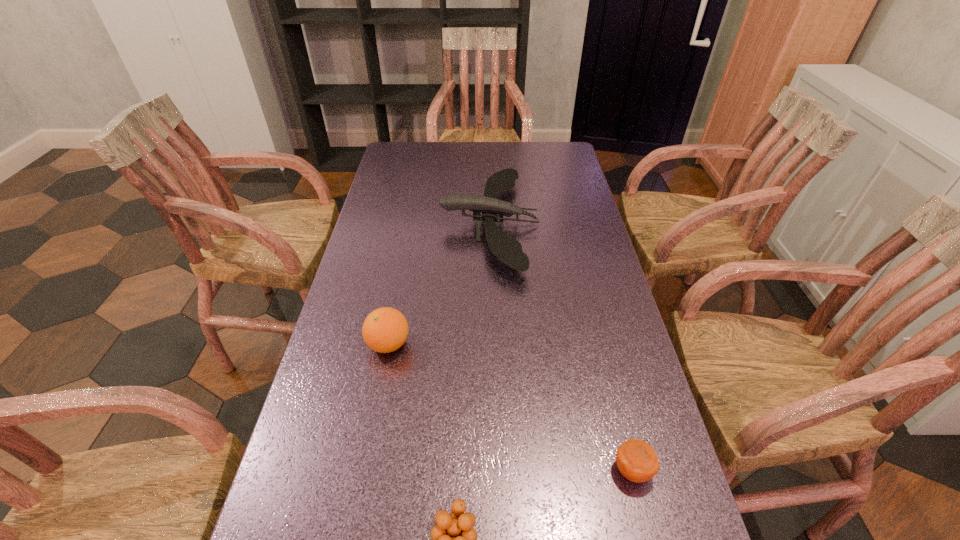
Find the location of a particular element. This screenshot has width=960, height=540. object that is positioned at the left edge is located at coordinates (384, 330).

Find the location of a particular element. object that is at the right edge is located at coordinates (637, 461).

The image size is (960, 540). Find the location of `free space at the far edge`. free space at the far edge is located at coordinates (468, 142).

Where is `vacant space at the left edge of the desktop`? This screenshot has height=540, width=960. vacant space at the left edge of the desktop is located at coordinates (370, 384).

Locate an element on the screen. The width and height of the screenshot is (960, 540). vacant space at the right edge of the desktop is located at coordinates (564, 234).

This screenshot has height=540, width=960. I want to click on blank space at the far left corner of the desktop, so click(x=399, y=170).

I want to click on free space between the drone and the leftmost orange fruit, so click(439, 284).

Identify the location of free spot between the tallest orange fruit and the second shortest object. This screenshot has width=960, height=540. (510, 407).

At what (x,y) coordinates should I click in order to perform the action: click on free space between the second nearest object and the farthest object. Please return your answer as a coordinate pair (x, y). Looking at the image, I should click on (561, 347).

Locate an element on the screen. This screenshot has width=960, height=540. object identified as the third closest to the third nearest object is located at coordinates (637, 461).